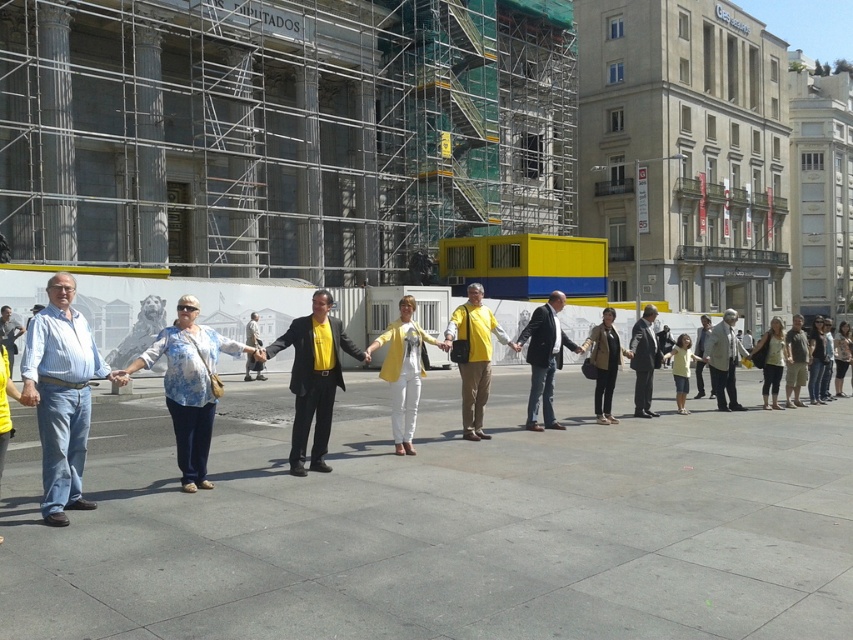
Question: Estimate the real-world distances between objects in this image. Which object is closer to the dark blue suit at center?

Choices:
 (A) light gray suit at center
 (B) light brown leather jacket at right
 (C) dark gray suit at center

Answer: (C)

Question: Can you confirm if matte yellow shirt at center is positioned above dark blue suit at center?

Choices:
 (A) yes
 (B) no

Answer: (A)

Question: Does denim jeans at left have a larger size compared to dark blue suit at center?

Choices:
 (A) yes
 (B) no

Answer: (A)

Question: Does matte black suit at center appear under light gray suit at center?

Choices:
 (A) yes
 (B) no

Answer: (A)

Question: Among these points, which one is farthest from the camera?

Choices:
 (A) (67, 332)
 (B) (488, 362)
 (C) (735, 340)
 (D) (640, 408)

Answer: (C)

Question: Among these points, which one is nearest to the camera?

Choices:
 (A) (527, 352)
 (B) (44, 464)
 (C) (468, 394)
 (D) (792, 369)

Answer: (B)